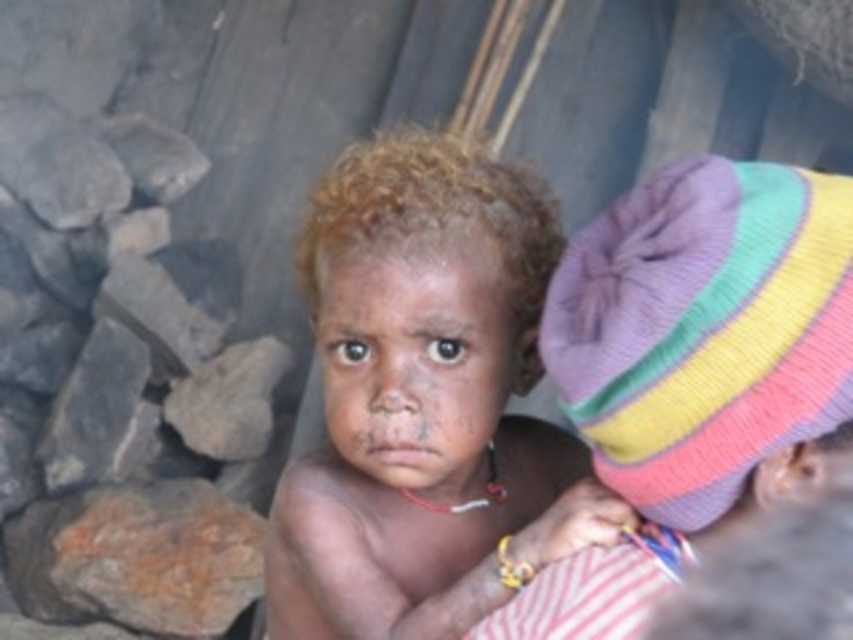
Is dark skin child at center above dark skin face at center?

No, dark skin child at center is not above dark skin face at center.

How far apart are dark skin child at center and dark skin face at center?

A distance of 1.47 inches exists between dark skin child at center and dark skin face at center.

Does point (316, 248) lie behind point (317, 312)?

No, it is not.

Locate an element on the screen. Image resolution: width=853 pixels, height=640 pixels. dark skin child at center is located at coordinates (426, 400).

Does dark skin child at center appear on the right side of knitted multicolored hat at right?

Incorrect, dark skin child at center is not on the right side of knitted multicolored hat at right.

Where is `dark skin child at center`? This screenshot has height=640, width=853. dark skin child at center is located at coordinates click(x=426, y=400).

Does knitted multicolored hat at right have a smaller size compared to dark skin face at center?

Indeed, knitted multicolored hat at right has a smaller size compared to dark skin face at center.

Is point (813, 353) positioned after point (491, 285)?

No, (813, 353) is closer to viewer.

At what (x,y) coordinates should I click in order to perform the action: click on knitted multicolored hat at right. Please return your answer as a coordinate pair (x, y). Looking at the image, I should click on pos(704,328).